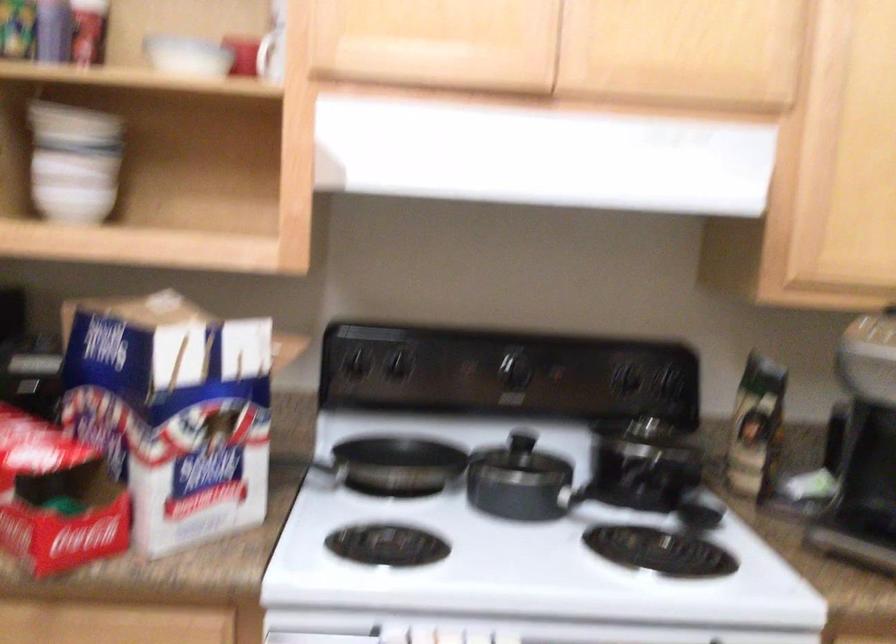
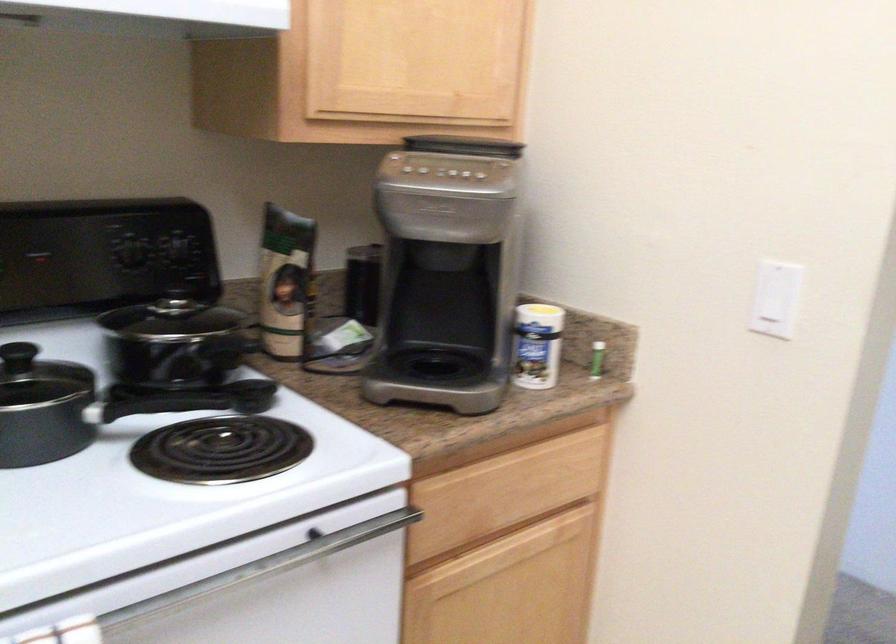
In the second image, find the point that corresponds to (648,415) in the first image.

(177, 290)